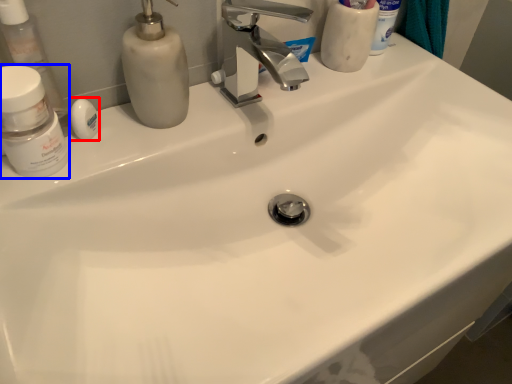
Question: Among these objects, which one is farthest to the camera, soap (highlighted by a red box) or mouthwash (highlighted by a blue box)?

Choices:
 (A) soap
 (B) mouthwash

Answer: (A)